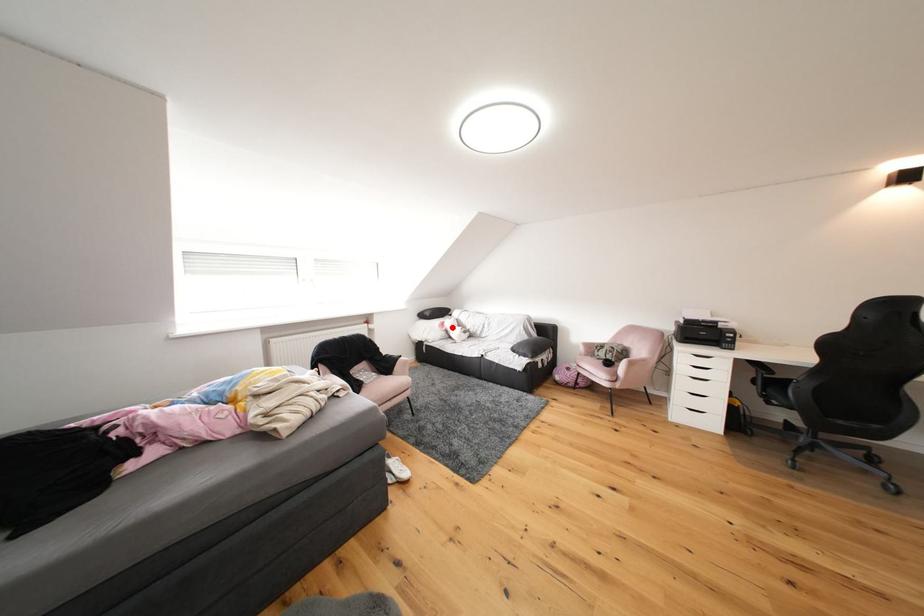
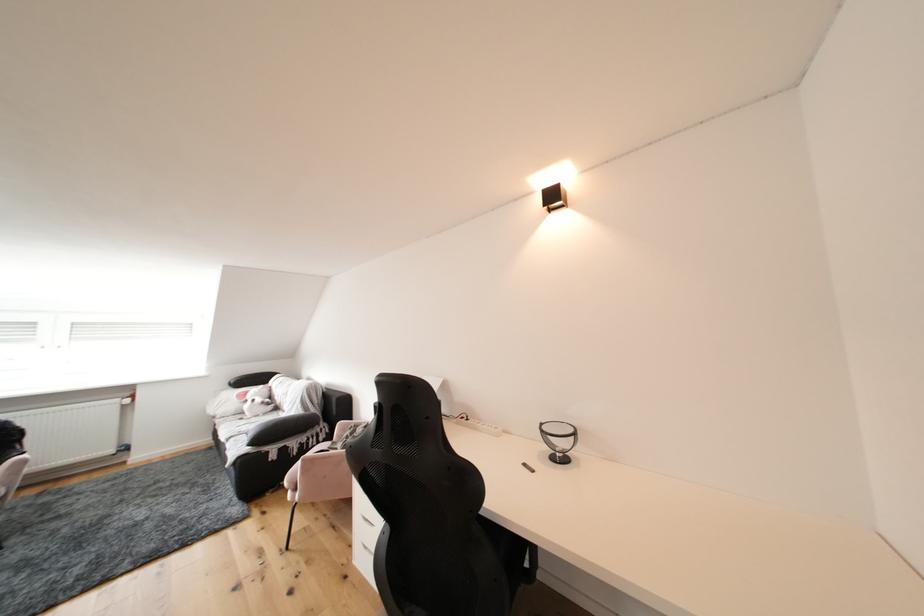
Find the pixel in the second image that matches the highlighted location in the first image.

(256, 397)